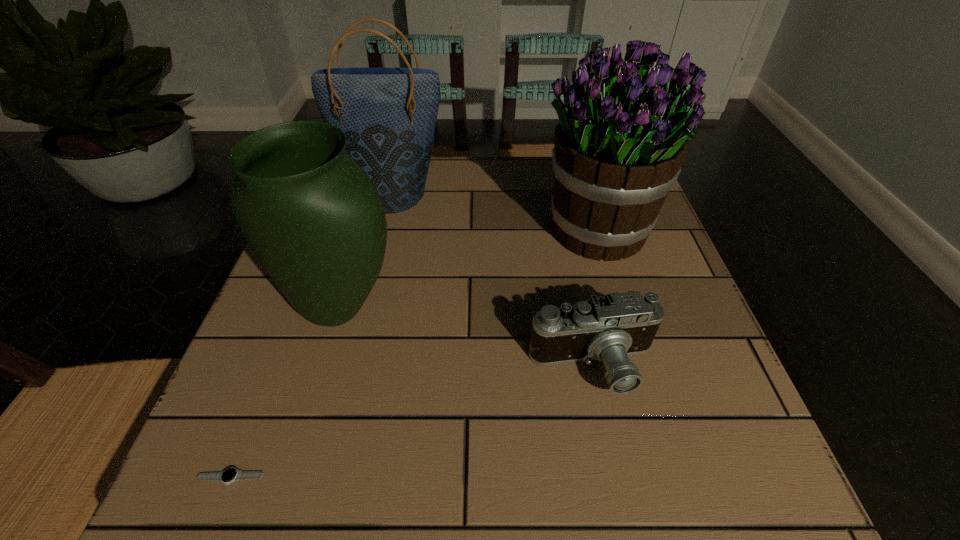
Where is `vacant space in between the vase and the fourth tallest object`? The width and height of the screenshot is (960, 540). vacant space in between the vase and the fourth tallest object is located at coordinates (468, 337).

Where is `vacant region between the nearest object and the second shortest object`? This screenshot has width=960, height=540. vacant region between the nearest object and the second shortest object is located at coordinates (412, 422).

Identify the location of vacant space that's between the vase and the bouquet. (469, 269).

The height and width of the screenshot is (540, 960). What are the coordinates of `unoccupied area between the watch and the shopping bag` in the screenshot? It's located at (312, 335).

Where is `vacant space that's between the camera and the vase`? The image size is (960, 540). vacant space that's between the camera and the vase is located at coordinates [x=468, y=337].

In order to click on object that ranks as the third closest to the camera in this screenshot , I will do `click(388, 115)`.

Identify which object is the nearest to the shopping bag. Please provide its 2D coordinates. Your answer should be formatted as a tuple, i.e. [(x, y)], where the tuple contains the x and y coordinates of a point satisfying the conditions above.

[(314, 219)]